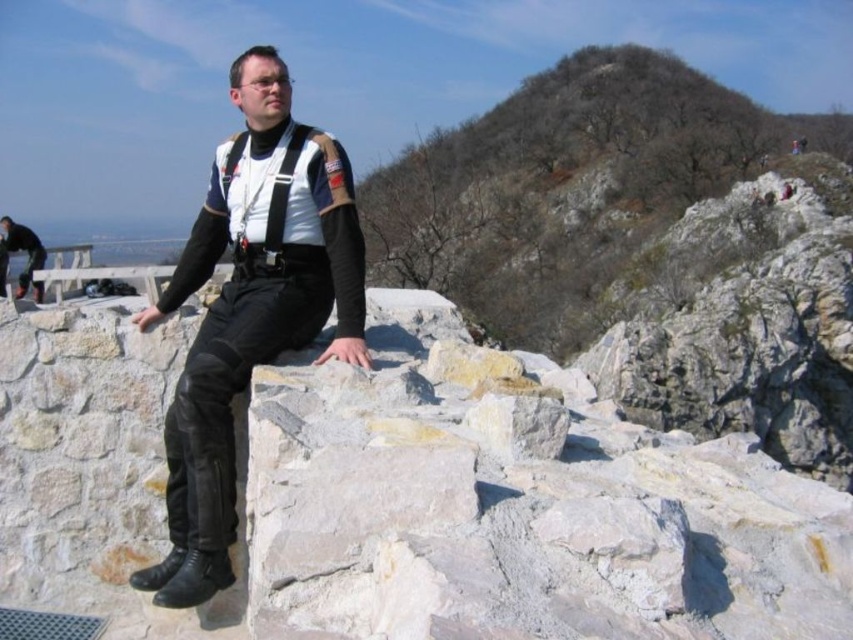
Question: Which of the following is the farthest from the observer?

Choices:
 (A) (241, 195)
 (B) (7, 243)

Answer: (B)

Question: Which object is closer to the camera taking this photo?

Choices:
 (A) matte black leather pants at center
 (B) black leather pants at lower left

Answer: (A)

Question: Which object is closer to the camera taking this photo?

Choices:
 (A) matte black leather pants at center
 (B) black leather pants at lower left

Answer: (A)

Question: Is matte black leather pants at center above black leather pants at lower left?

Choices:
 (A) no
 (B) yes

Answer: (A)

Question: Is matte black leather pants at center smaller than black leather pants at lower left?

Choices:
 (A) no
 (B) yes

Answer: (B)

Question: Does matte black leather pants at center have a greater width compared to black leather pants at lower left?

Choices:
 (A) yes
 (B) no

Answer: (B)